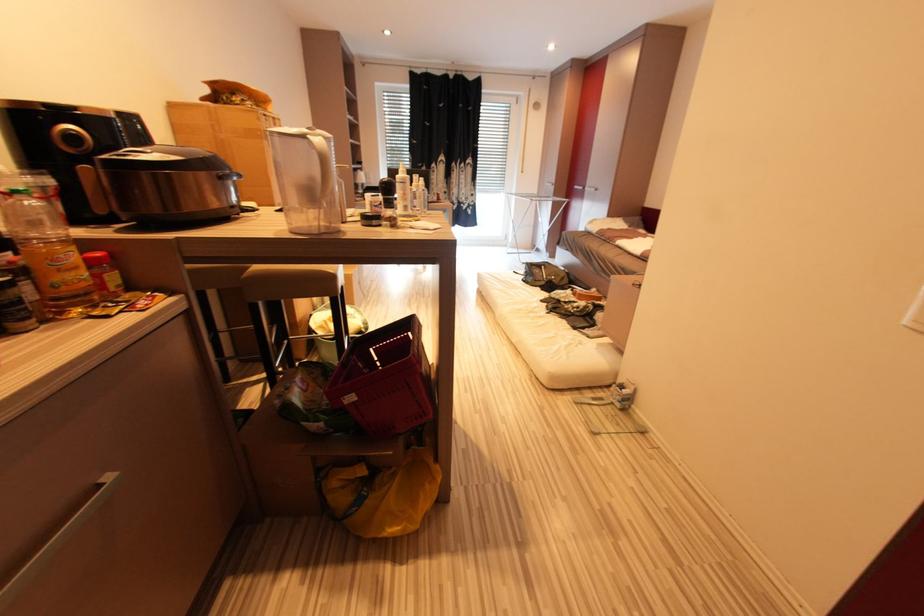
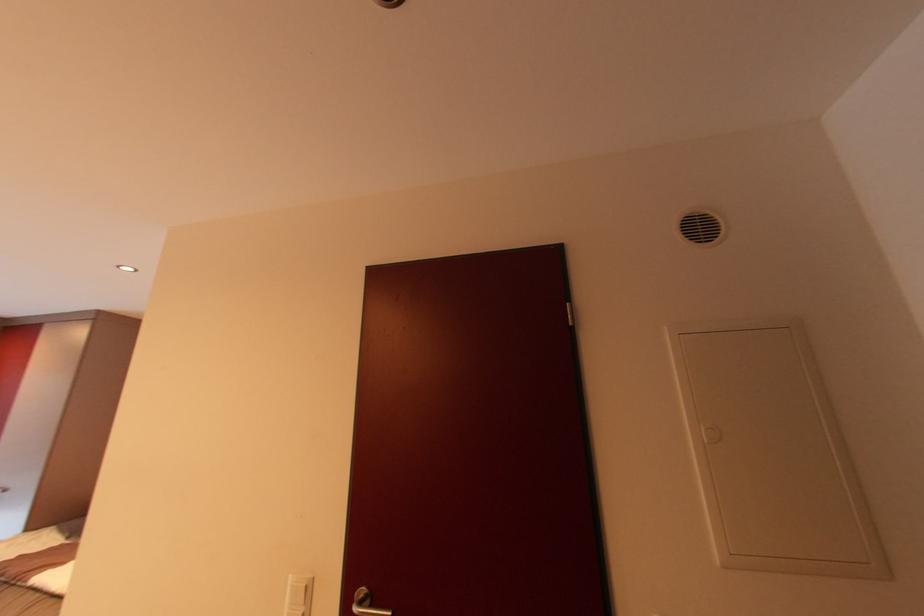
How did the camera likely rotate?

The camera's rotation is toward right-up.